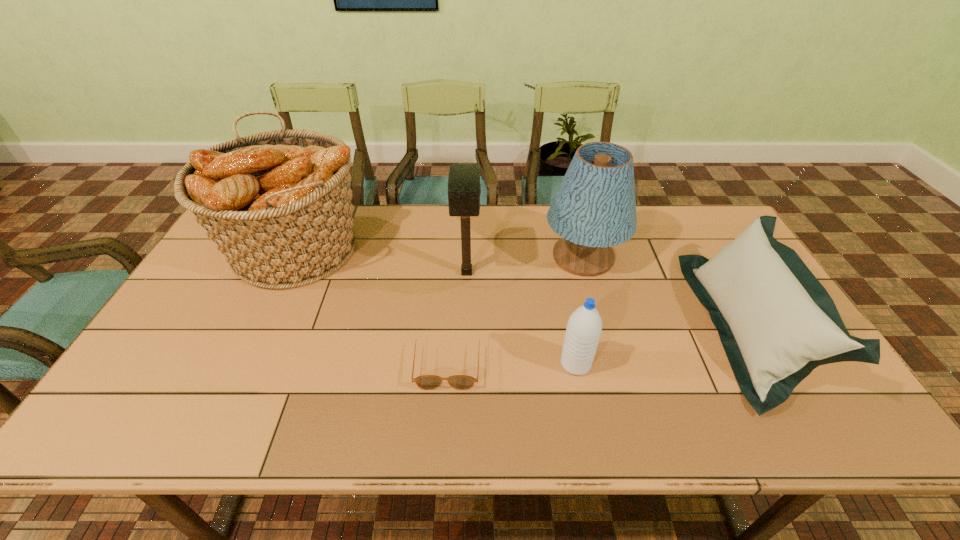
Locate an element on the screen. vacant region located on the surface of the rightmost object is located at coordinates (666, 327).

I want to click on free space located 0.220m on the surface of the rightmost object, so click(625, 327).

Identify the location of vacant space situated 0.160m on the surface of the rightmost object. (648, 327).

You are a GUI agent. You are given a task and a screenshot of the screen. Output one action in this format:
    pyautogui.click(x=<x>, y=<y>)
    Task: Click on the vacant position located 0.070m on the front-facing side of the shortest object
    
    Given the screenshot: What is the action you would take?
    pyautogui.click(x=444, y=418)

You are a GUI agent. You are given a task and a screenshot of the screen. Output one action in this format:
    pyautogui.click(x=<x>, y=<y>)
    Task: Click on the basket that is at the far edge
    
    Given the screenshot: What is the action you would take?
    pyautogui.click(x=277, y=204)

At what (x,y) coordinates should I click in order to perform the action: click on lampshade located at the far edge. Please return your answer as a coordinate pair (x, y). The width and height of the screenshot is (960, 540). Looking at the image, I should click on (594, 208).

Find the location of a particular element. The height and width of the screenshot is (540, 960). object that is at the near edge is located at coordinates (777, 323).

Identify the location of object that is positioned at the left edge. (277, 204).

Image resolution: width=960 pixels, height=540 pixels. I want to click on object located in the right edge section of the desktop, so click(x=777, y=323).

The image size is (960, 540). I want to click on object situated at the far left corner, so click(x=277, y=204).